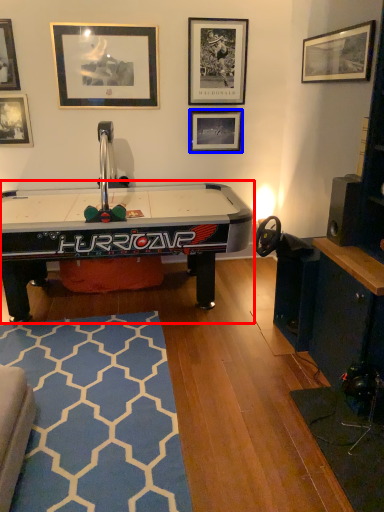
Question: Which object is further to the camera taking this photo, table (highlighted by a red box) or picture frame (highlighted by a blue box)?

Choices:
 (A) table
 (B) picture frame

Answer: (B)